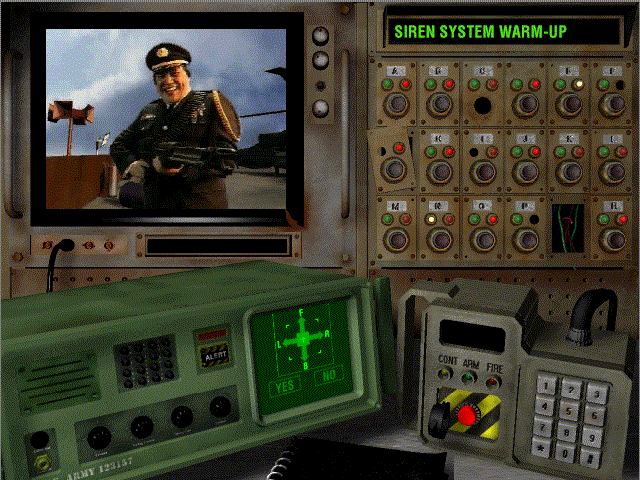
Find the location of a particular element. The width and height of the screenshot is (640, 480). black knobs is located at coordinates (100, 434), (141, 433), (184, 422), (227, 411).